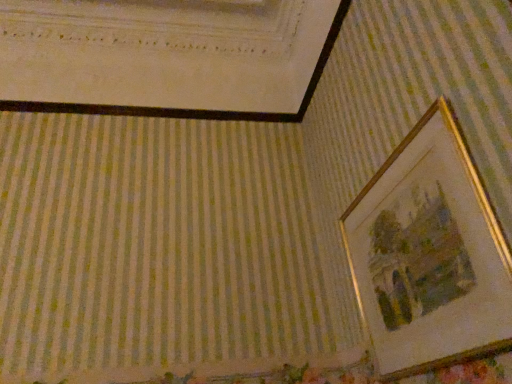
Where is `gold metallic picture frame at lower right`? This screenshot has height=384, width=512. gold metallic picture frame at lower right is located at coordinates (429, 253).

What do you see at coordinates (429, 253) in the screenshot?
I see `gold metallic picture frame at lower right` at bounding box center [429, 253].

In order to click on gold metallic picture frame at lower right in this screenshot , I will do `click(429, 253)`.